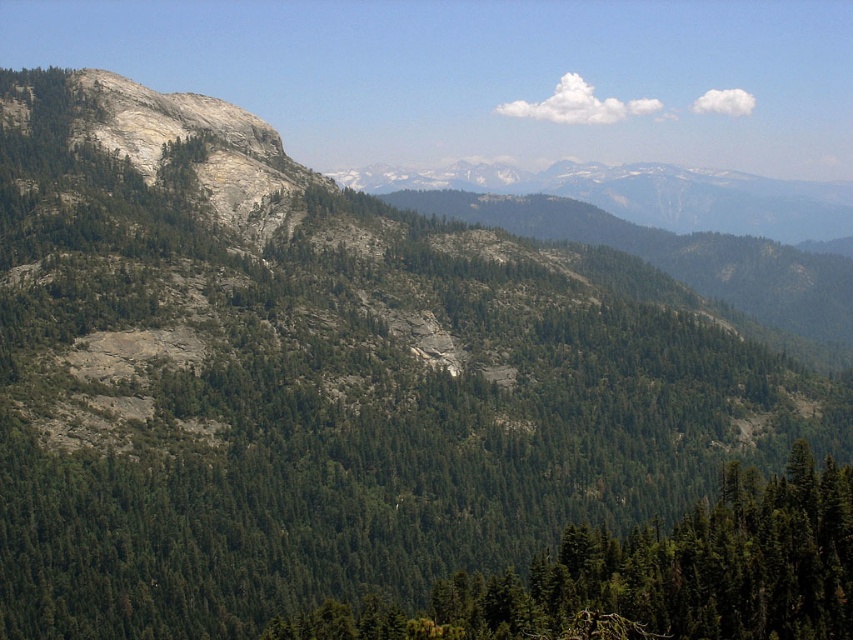
You are standing in the forest and see the green matte tree at lower center and the gray rocky mountain range at center. Which object is positioned more to the left from your perspective?

The green matte tree at lower center is positioned more to the left from your perspective than the gray rocky mountain range at center.

You are an environmental scientist assessing the landscape. You need to determine which object, the green matte tree at lower center or the gray rocky mountain range at center, is closer to you based on their sizes. Which one is closer?

The green matte tree at lower center is closer because it has a smaller size compared to the gray rocky mountain range at center, which is farther away.